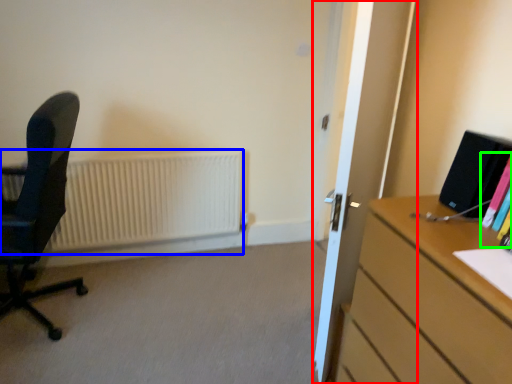
Question: Which object is the closest to the glass door (highlighted by a red box)? Choose among these: radiator (highlighted by a blue box) or book (highlighted by a green box).

Choices:
 (A) radiator
 (B) book

Answer: (B)